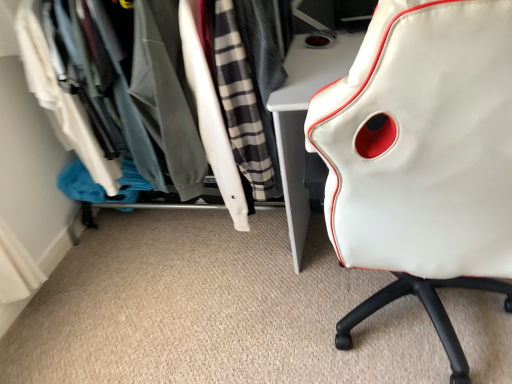
Question: Is white leather chair at right further to the viewer compared to white fabric closet at upper left?

Choices:
 (A) no
 (B) yes

Answer: (A)

Question: Does white leather chair at right come in front of white fabric closet at upper left?

Choices:
 (A) yes
 (B) no

Answer: (A)

Question: From a real-world perspective, is white leather chair at right located higher than white fabric closet at upper left?

Choices:
 (A) no
 (B) yes

Answer: (B)

Question: Is white leather chair at right to the right of white fabric closet at upper left from the viewer's perspective?

Choices:
 (A) yes
 (B) no

Answer: (A)

Question: Does white leather chair at right have a larger size compared to white fabric closet at upper left?

Choices:
 (A) yes
 (B) no

Answer: (B)

Question: Does white leather chair at right have a lesser height compared to white fabric closet at upper left?

Choices:
 (A) no
 (B) yes

Answer: (A)

Question: Can we say white fabric closet at upper left lies outside white leather chair at right?

Choices:
 (A) yes
 (B) no

Answer: (A)

Question: From the image's perspective, is white fabric closet at upper left on top of white leather chair at right?

Choices:
 (A) yes
 (B) no

Answer: (A)

Question: Is white fabric closet at upper left aimed at white leather chair at right?

Choices:
 (A) yes
 (B) no

Answer: (B)

Question: Does white fabric closet at upper left appear on the right side of white leather chair at right?

Choices:
 (A) no
 (B) yes

Answer: (A)

Question: Can you confirm if white fabric closet at upper left is smaller than white leather chair at right?

Choices:
 (A) no
 (B) yes

Answer: (A)

Question: From a real-world perspective, is white fabric closet at upper left physically above white leather chair at right?

Choices:
 (A) yes
 (B) no

Answer: (B)

Question: From the image's perspective, is white fabric closet at upper left located above or below white leather chair at right?

Choices:
 (A) above
 (B) below

Answer: (A)